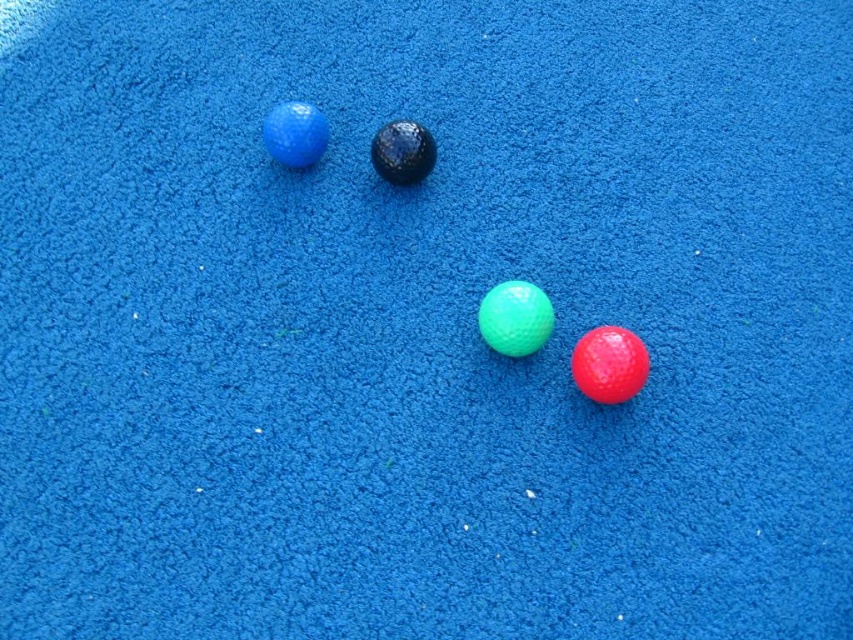
Which is below, matte blue golf ball at upper left or glossy black golf ball at center?

glossy black golf ball at center

What do you see at coordinates (294, 132) in the screenshot?
I see `matte blue golf ball at upper left` at bounding box center [294, 132].

The width and height of the screenshot is (853, 640). Identify the location of matte blue golf ball at upper left. (294, 132).

The width and height of the screenshot is (853, 640). In order to click on matte blue golf ball at upper left in this screenshot , I will do `click(294, 132)`.

Looking at this image, which of these two, glossy rubber ball at lower right or matte blue golf ball at upper left, stands shorter?

Standing shorter between the two is matte blue golf ball at upper left.

Does glossy rubber ball at lower right have a greater width compared to matte blue golf ball at upper left?

No.

Is point (595, 356) closer to viewer compared to point (289, 122)?

Yes, point (595, 356) is in front of point (289, 122).

What are the coordinates of `glossy rubber ball at lower right` in the screenshot? It's located at (608, 364).

Who is positioned more to the right, glossy green golf ball at center or glossy black golf ball at center?

glossy green golf ball at center

Is point (496, 284) positioned in front of point (404, 140)?

No, (496, 284) is further to viewer.

You are a GUI agent. You are given a task and a screenshot of the screen. Output one action in this format:
    pyautogui.click(x=<x>, y=<y>)
    Task: Click on the glossy green golf ball at center
    The width and height of the screenshot is (853, 640).
    Given the screenshot: What is the action you would take?
    pyautogui.click(x=515, y=317)